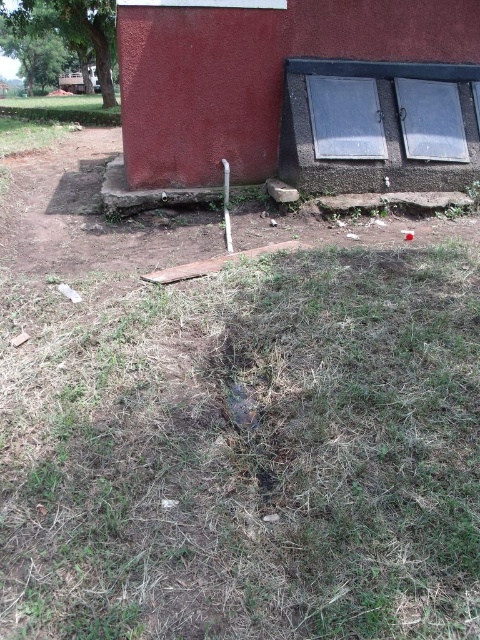
You are a gardener assessing the condition of the property. You notice the brown dry grass at center and the smooth red barn at center. Which object is positioned lower in the scene?

The brown dry grass at center is positioned lower than the smooth red barn at center according to the description.

You are standing in front of the building and want to place a small flag at each of the two points labeled point (304, 540) and point (321, 138). Which point will have its flag appear larger in your view?

Point (304, 540) is closer to the camera than point (321, 138), so the flag placed at point (304, 540) will appear larger in your view.